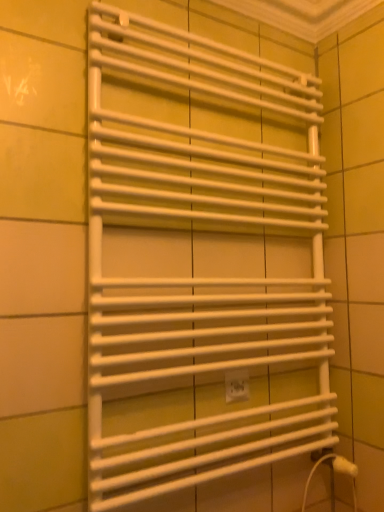
Question: Is the position of white matte towel rack at center less distant than that of white plastic electric outlet at center?

Choices:
 (A) yes
 (B) no

Answer: (A)

Question: Considering the relative sizes of white matte towel rack at center and white plastic electric outlet at center in the image provided, is white matte towel rack at center wider than white plastic electric outlet at center?

Choices:
 (A) yes
 (B) no

Answer: (A)

Question: Is white matte towel rack at center outside of white plastic electric outlet at center?

Choices:
 (A) yes
 (B) no

Answer: (A)

Question: Can you confirm if white matte towel rack at center is positioned to the right of white plastic electric outlet at center?

Choices:
 (A) no
 (B) yes

Answer: (A)

Question: Is white matte towel rack at center turned away from white plastic electric outlet at center?

Choices:
 (A) yes
 (B) no

Answer: (A)

Question: Are white matte towel rack at center and white plastic electric outlet at center making contact?

Choices:
 (A) yes
 (B) no

Answer: (B)

Question: Does white plastic electric outlet at center come behind white matte towel rack at center?

Choices:
 (A) no
 (B) yes

Answer: (B)

Question: Considering the relative positions of white plastic electric outlet at center and white matte towel rack at center in the image provided, is white plastic electric outlet at center to the left of white matte towel rack at center from the viewer's perspective?

Choices:
 (A) yes
 (B) no

Answer: (B)

Question: Does white plastic electric outlet at center lie in front of white matte towel rack at center?

Choices:
 (A) yes
 (B) no

Answer: (B)

Question: Is white plastic electric outlet at center completely or partially outside of white matte towel rack at center?

Choices:
 (A) no
 (B) yes

Answer: (A)

Question: From a real-world perspective, does white plastic electric outlet at center stand above white matte towel rack at center?

Choices:
 (A) no
 (B) yes

Answer: (A)

Question: Is white plastic electric outlet at center bigger than white matte towel rack at center?

Choices:
 (A) yes
 (B) no

Answer: (B)

Question: Is point (296, 202) positioned closer to the camera than point (241, 396)?

Choices:
 (A) closer
 (B) farther

Answer: (B)